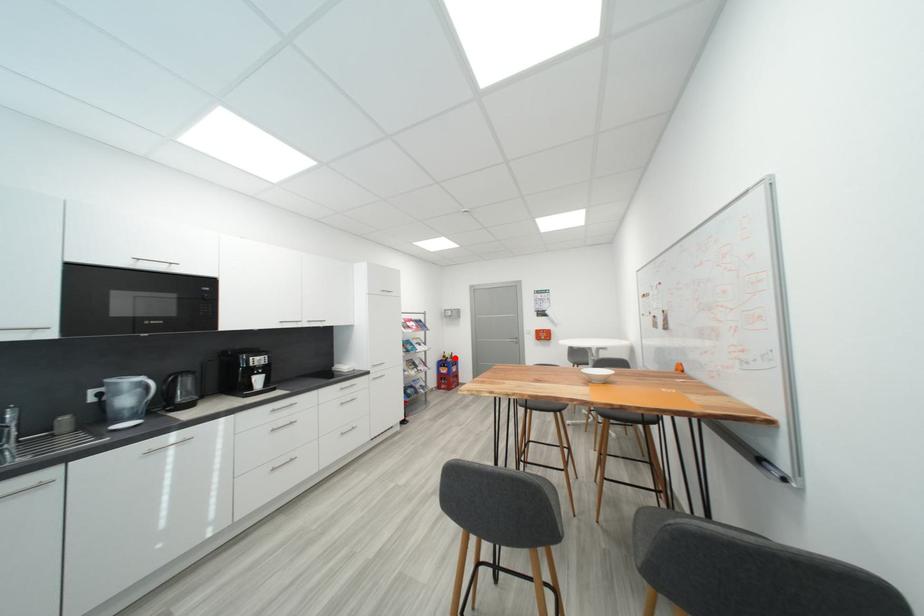
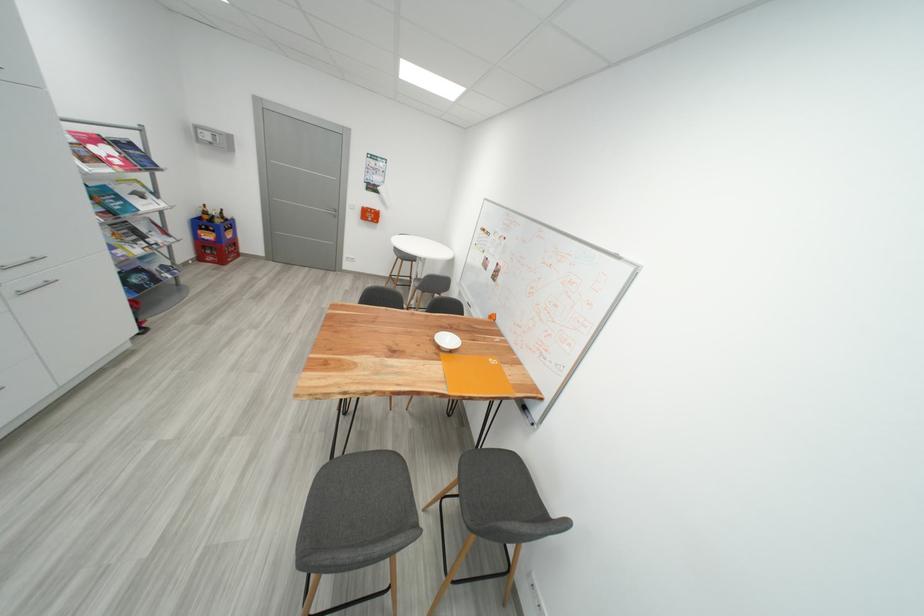
Question: I am providing you with two images of the same scene from different viewpoints. A red point is shown in image1. For the corresponding object point in image2, is it positioned nearer or farther from the camera?

Choices:
 (A) Nearer
 (B) Farther

Answer: (A)